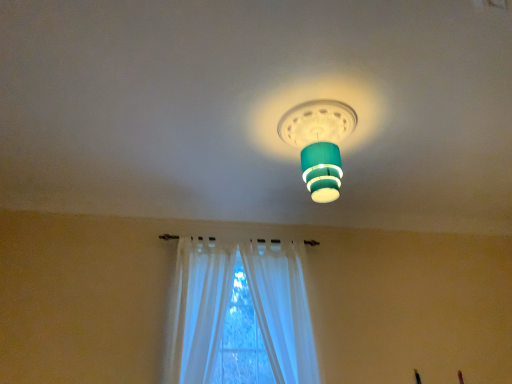
Identify the location of white sheer curtain at center, which is the 2th curtain from left to right. The height and width of the screenshot is (384, 512). click(x=282, y=310).

Image resolution: width=512 pixels, height=384 pixels. I want to click on white sheer curtain at center, which is the 2th curtain from left to right, so click(282, 310).

From a real-world perspective, is teal matte lampshade at center physically located above or below white sheer curtain at center, which is the 2th curtain from left to right?

teal matte lampshade at center is above white sheer curtain at center, which is the 2th curtain from left to right.

Does teal matte lampshade at center have a lesser height compared to white sheer curtain at center, which is the 2th curtain from left to right?

Yes.

Is teal matte lampshade at center smaller than white sheer curtain at center, which is counted as the first curtain, starting from the right?

Yes.

Consider the image. Is white sheer curtain at lower center, which ranks as the first curtain in left-to-right order, completely or partially outside of white sheer curtain at center, which is the 2th curtain from left to right?

Yes.

Measure the distance from white sheer curtain at lower center, which ranks as the first curtain in left-to-right order, to white sheer curtain at center, which is the 2th curtain from left to right.

white sheer curtain at lower center, which ranks as the first curtain in left-to-right order, is 46.41 centimeters away from white sheer curtain at center, which is the 2th curtain from left to right.

Does white sheer curtain at lower center, the 2th curtain in the right-to-left sequence, have a lesser width compared to white sheer curtain at center, which is counted as the first curtain, starting from the right?

No.

Is white sheer curtain at lower center, which ranks as the first curtain in left-to-right order, oriented towards white sheer curtain at center, which is the 2th curtain from left to right?

No, white sheer curtain at lower center, which ranks as the first curtain in left-to-right order, is not aimed at white sheer curtain at center, which is the 2th curtain from left to right.

Can you tell me how much white sheer curtain at center, which is the 2th curtain from left to right, and teal matte lampshade at center differ in facing direction?

83.4 degrees.

I want to click on the 2nd curtain behind the teal matte lampshade at center, so click(282, 310).

From a real-world perspective, is white sheer curtain at center, which is the 2th curtain from left to right, beneath teal matte lampshade at center?

Yes.

Is white sheer curtain at center, which is the 2th curtain from left to right, thinner than white sheer curtain at lower center, the 2th curtain in the right-to-left sequence?

Correct, the width of white sheer curtain at center, which is the 2th curtain from left to right, is less than that of white sheer curtain at lower center, the 2th curtain in the right-to-left sequence.

Are white sheer curtain at center, which is the 2th curtain from left to right, and white sheer curtain at lower center, which ranks as the first curtain in left-to-right order, far apart?

They are positioned close to each other.

Considering the positions of objects white sheer curtain at center, which is the 2th curtain from left to right, and white sheer curtain at lower center, which ranks as the first curtain in left-to-right order, in the image provided, who is behind, white sheer curtain at center, which is the 2th curtain from left to right, or white sheer curtain at lower center, which ranks as the first curtain in left-to-right order,?

white sheer curtain at center, which is the 2th curtain from left to right, is more distant.

Measure the distance from white sheer curtain at center, which is the 2th curtain from left to right, to white sheer curtain at lower center, which ranks as the first curtain in left-to-right order.

A distance of 46.41 centimeters exists between white sheer curtain at center, which is the 2th curtain from left to right, and white sheer curtain at lower center, which ranks as the first curtain in left-to-right order.

Which of these two, white sheer curtain at lower center, the 2th curtain in the right-to-left sequence, or teal matte lampshade at center, is smaller?

teal matte lampshade at center is smaller.

Is teal matte lampshade at center surrounded by white sheer curtain at lower center, the 2th curtain in the right-to-left sequence?

No, teal matte lampshade at center is not inside white sheer curtain at lower center, the 2th curtain in the right-to-left sequence.

Considering the relative sizes of white sheer curtain at lower center, which ranks as the first curtain in left-to-right order, and teal matte lampshade at center in the image provided, is white sheer curtain at lower center, which ranks as the first curtain in left-to-right order, wider than teal matte lampshade at center?

Incorrect, the width of white sheer curtain at lower center, which ranks as the first curtain in left-to-right order, does not surpass that of teal matte lampshade at center.

What are the coordinates of `lamp on the right of white sheer curtain at lower center, the 2th curtain in the right-to-left sequence` in the screenshot? It's located at click(319, 143).

Is teal matte lampshade at center positioned beyond the bounds of white sheer curtain at lower center, the 2th curtain in the right-to-left sequence?

Yes.

From a real-world perspective, is teal matte lampshade at center above or below white sheer curtain at lower center, which ranks as the first curtain in left-to-right order?

teal matte lampshade at center is above white sheer curtain at lower center, which ranks as the first curtain in left-to-right order.

Is teal matte lampshade at center taller than white sheer curtain at lower center, the 2th curtain in the right-to-left sequence?

In fact, teal matte lampshade at center may be shorter than white sheer curtain at lower center, the 2th curtain in the right-to-left sequence.

You are a GUI agent. You are given a task and a screenshot of the screen. Output one action in this format:
    pyautogui.click(x=<x>, y=<y>)
    Task: Click on the lamp that appears on the right of white sheer curtain at center, which is counted as the first curtain, starting from the right
    
    Given the screenshot: What is the action you would take?
    pyautogui.click(x=319, y=143)

This screenshot has height=384, width=512. Identify the location of curtain below the white sheer curtain at lower center, which ranks as the first curtain in left-to-right order (from a real-world perspective). (282, 310).

Considering their positions, is white sheer curtain at lower center, the 2th curtain in the right-to-left sequence, positioned closer to white sheer curtain at center, which is counted as the first curtain, starting from the right, than teal matte lampshade at center?

Among the two, white sheer curtain at lower center, the 2th curtain in the right-to-left sequence, is located nearer to white sheer curtain at center, which is counted as the first curtain, starting from the right.

When comparing their distances from white sheer curtain at center, which is counted as the first curtain, starting from the right, does teal matte lampshade at center or white sheer curtain at lower center, the 2th curtain in the right-to-left sequence, seem further?

teal matte lampshade at center is positioned further to the anchor white sheer curtain at center, which is counted as the first curtain, starting from the right.

Which object lies further to the anchor point white sheer curtain at lower center, the 2th curtain in the right-to-left sequence, teal matte lampshade at center or white sheer curtain at center, which is counted as the first curtain, starting from the right?

Among the two, teal matte lampshade at center is located further to white sheer curtain at lower center, the 2th curtain in the right-to-left sequence.

Looking at the image, which one is located closer to teal matte lampshade at center, white sheer curtain at lower center, which ranks as the first curtain in left-to-right order, or white sheer curtain at center, which is counted as the first curtain, starting from the right?

Among the two, white sheer curtain at center, which is counted as the first curtain, starting from the right, is located nearer to teal matte lampshade at center.

When comparing their distances from teal matte lampshade at center, does white sheer curtain at center, which is counted as the first curtain, starting from the right, or white sheer curtain at lower center, which ranks as the first curtain in left-to-right order, seem further?

white sheer curtain at lower center, which ranks as the first curtain in left-to-right order.

Consider the image. Considering their positions, is white sheer curtain at center, which is counted as the first curtain, starting from the right, positioned further to white sheer curtain at lower center, the 2th curtain in the right-to-left sequence, than teal matte lampshade at center?

teal matte lampshade at center is positioned further to the anchor white sheer curtain at lower center, the 2th curtain in the right-to-left sequence.

The image size is (512, 384). I want to click on curtain between teal matte lampshade at center and white sheer curtain at center, which is counted as the first curtain, starting from the right, from top to bottom, so click(x=197, y=310).